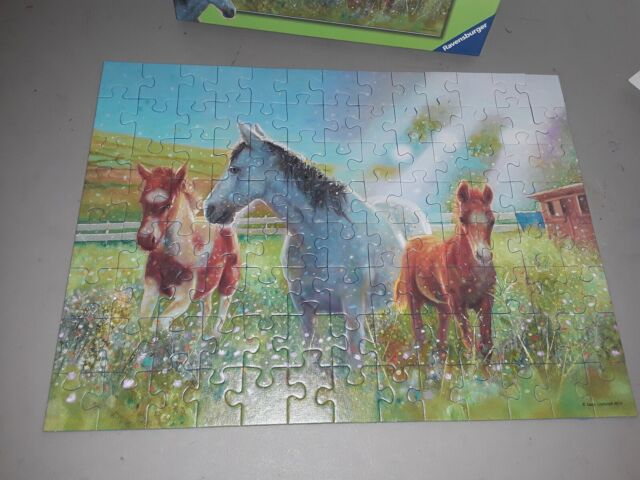
Where is `box`? This screenshot has height=480, width=640. box is located at coordinates (452, 28).